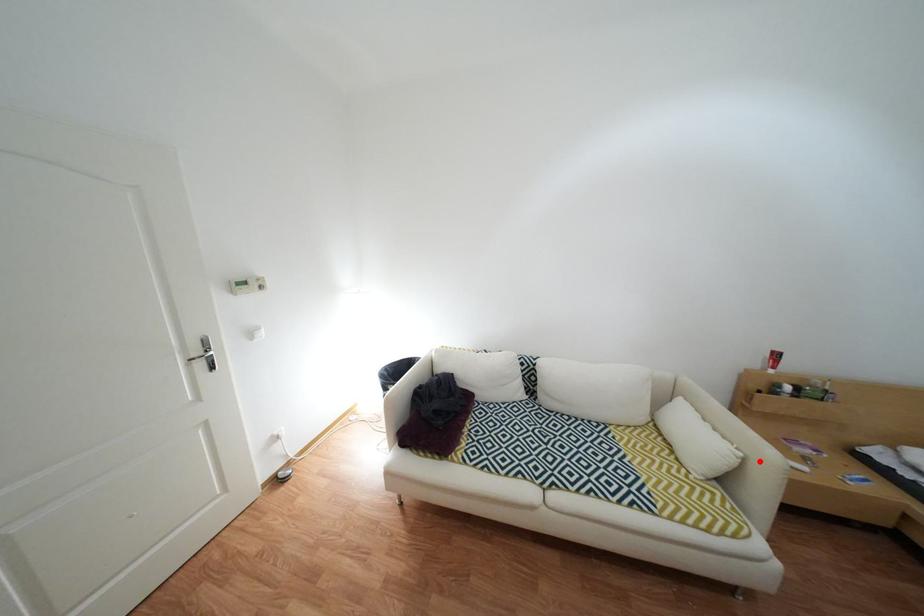
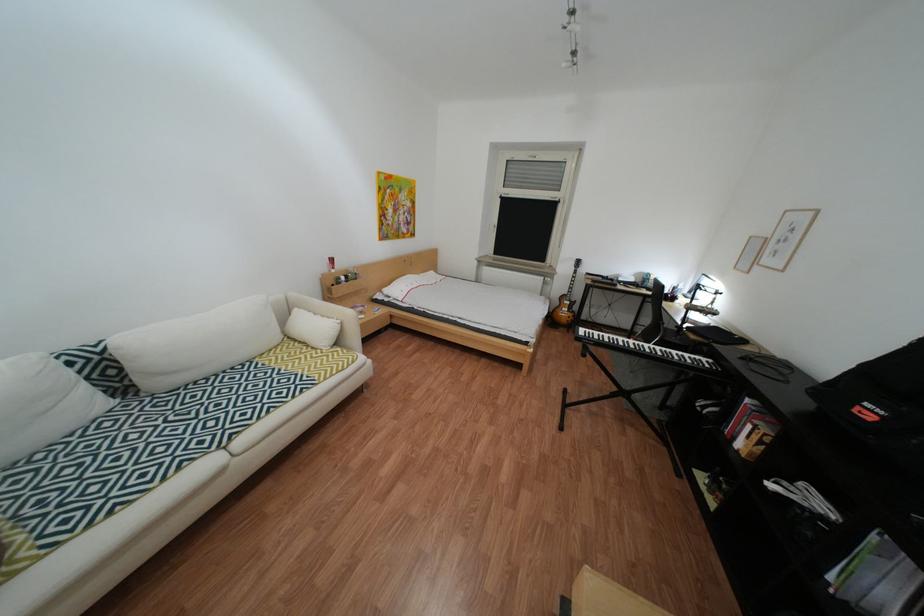
Question: I am providing you with two images of the same scene from different viewpoints. Image1 has a red point marked. In image2, the corresponding 3D location appears at what relative position? Reply with the corresponding letter.

Choices:
 (A) Closer
 (B) Farther

Answer: (A)